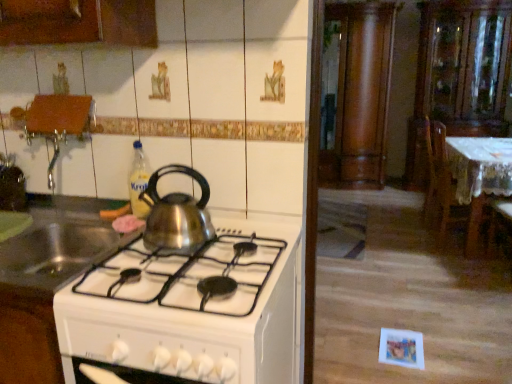
Question: Which direction should I rotate to face wooden column at center, which is the first cabinetry in left-to-right order, — up or down?

Choices:
 (A) up
 (B) down

Answer: (A)

Question: Is shiny metallic kettle at center, which appears as the 1th kitchen appliance when viewed from the right, smaller than wooden column at center, marked as the 2th cabinetry in a right-to-left arrangement?

Choices:
 (A) yes
 (B) no

Answer: (A)

Question: Is shiny metallic kettle at center, which is the 3th kitchen appliance from left to right, not close to wooden column at center, which is the first cabinetry in left-to-right order?

Choices:
 (A) yes
 (B) no

Answer: (A)

Question: Could you tell me if shiny metallic kettle at center, which is the 3th kitchen appliance from left to right, is turned towards wooden column at center, which is the first cabinetry in left-to-right order?

Choices:
 (A) yes
 (B) no

Answer: (B)

Question: Is wooden column at center, marked as the 2th cabinetry in a right-to-left arrangement, surrounded by shiny metallic kettle at center, which appears as the 1th kitchen appliance when viewed from the right?

Choices:
 (A) no
 (B) yes

Answer: (A)

Question: From the image's perspective, is shiny metallic kettle at center, which is the 3th kitchen appliance from left to right, under wooden column at center, marked as the 2th cabinetry in a right-to-left arrangement?

Choices:
 (A) yes
 (B) no

Answer: (A)

Question: Is shiny metallic kettle at center, which is the 3th kitchen appliance from left to right, bigger than wooden column at center, marked as the 2th cabinetry in a right-to-left arrangement?

Choices:
 (A) no
 (B) yes

Answer: (A)

Question: Does wooden chair at right have a smaller size compared to shiny metallic kettle at center, which appears as the 1th kitchen appliance when viewed from the right?

Choices:
 (A) no
 (B) yes

Answer: (A)

Question: Is wooden chair at right to the left of shiny metallic kettle at center, which is the 3th kitchen appliance from left to right, from the viewer's perspective?

Choices:
 (A) yes
 (B) no

Answer: (B)

Question: Is wooden chair at right further to camera compared to shiny metallic kettle at center, which is the 3th kitchen appliance from left to right?

Choices:
 (A) no
 (B) yes

Answer: (B)

Question: From a real-world perspective, is wooden chair at right located beneath shiny metallic kettle at center, which is the 3th kitchen appliance from left to right?

Choices:
 (A) no
 (B) yes

Answer: (B)

Question: Is wooden chair at right far away from shiny metallic kettle at center, which appears as the 1th kitchen appliance when viewed from the right?

Choices:
 (A) yes
 (B) no

Answer: (A)

Question: Considering the relative positions of wooden chair at right and shiny metallic kettle at center, which is the 3th kitchen appliance from left to right, in the image provided, is wooden chair at right in front of shiny metallic kettle at center, which is the 3th kitchen appliance from left to right,?

Choices:
 (A) yes
 (B) no

Answer: (B)

Question: From a real-world perspective, does translucent plastic bottle at upper center sit lower than shiny metallic kettle at center, which is the 3th kitchen appliance from left to right?

Choices:
 (A) no
 (B) yes

Answer: (A)